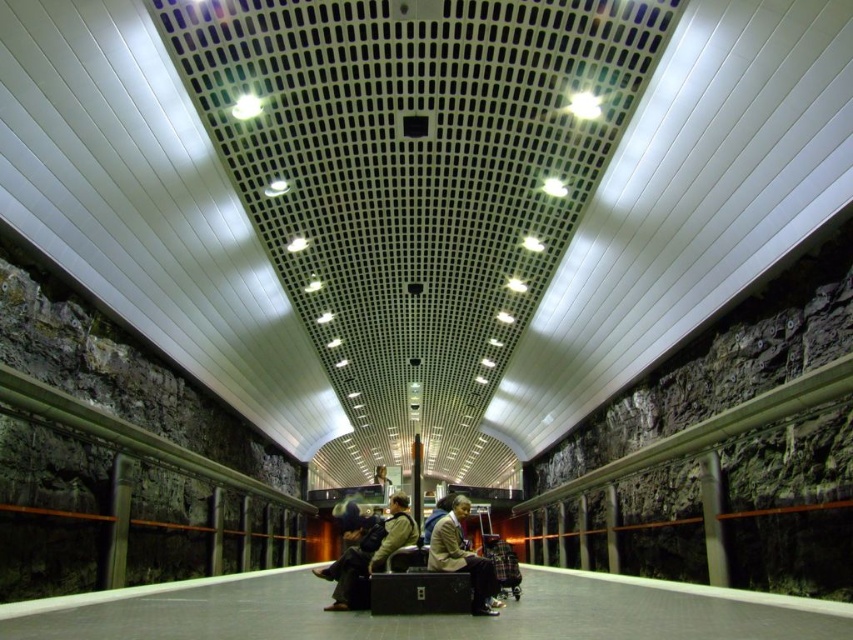
You are a commuter trying to decide which jacket to wear for your daily commute. You see both the dark gray fabric jacket at center and the tan leather jacket at center in the station. Which jacket is wider?

The dark gray fabric jacket at center is wider than the tan leather jacket at center according to the description.

You are standing at the point marked as point (364,552) in the station. You need to walk to the other side of the station, which is 8.13 meters away. How many steps would you need to take if each step covers 0.7 meters?

Since the distance between you and the other side is 8.13 meters and each step covers 0.7 meters, you would need approximately 12 steps to cover the distance.